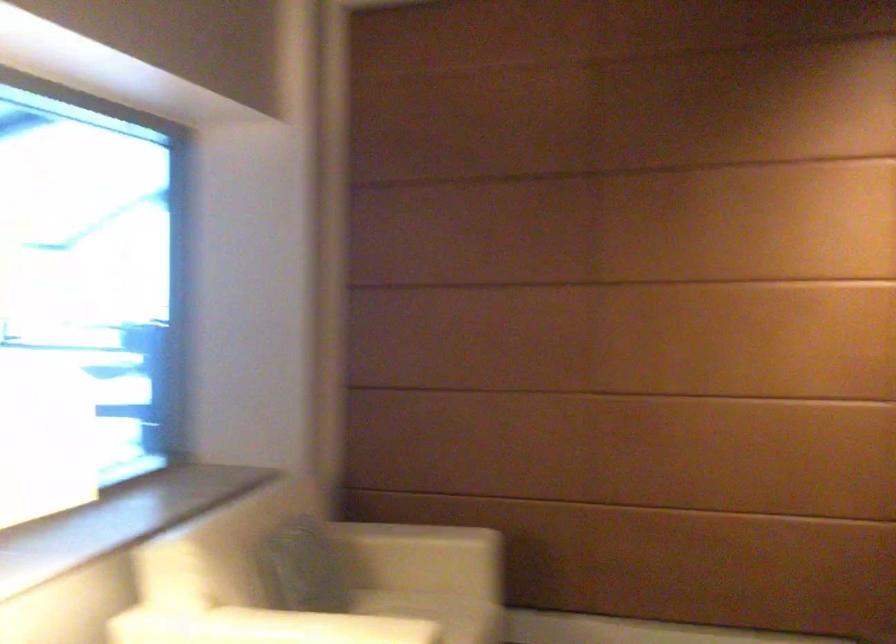
Find the location of `white chair armrest`. white chair armrest is located at coordinates (285, 625).